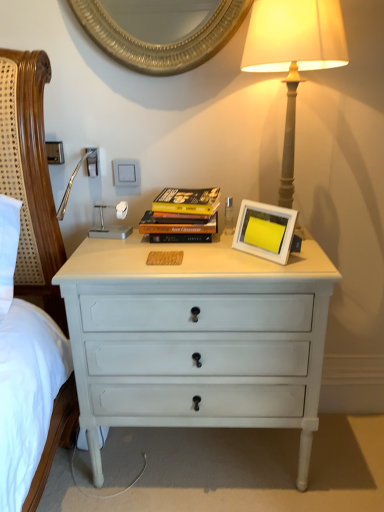
At what (x,y) coordinates should I click in order to perform the action: click on unoccupied area in front of hardcover books at center. Please return your answer as a coordinate pair (x, y). Image resolution: width=384 pixels, height=512 pixels. Looking at the image, I should click on (188, 254).